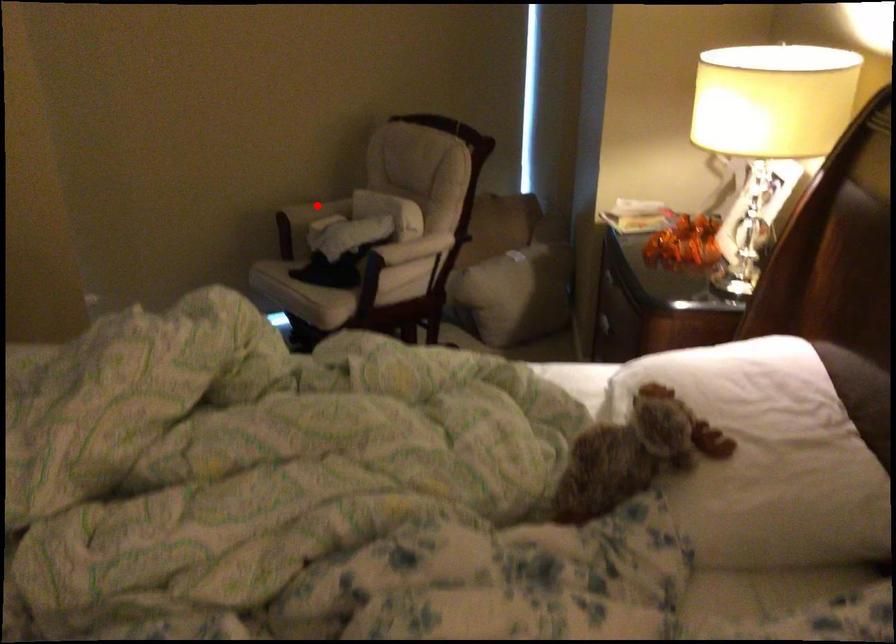
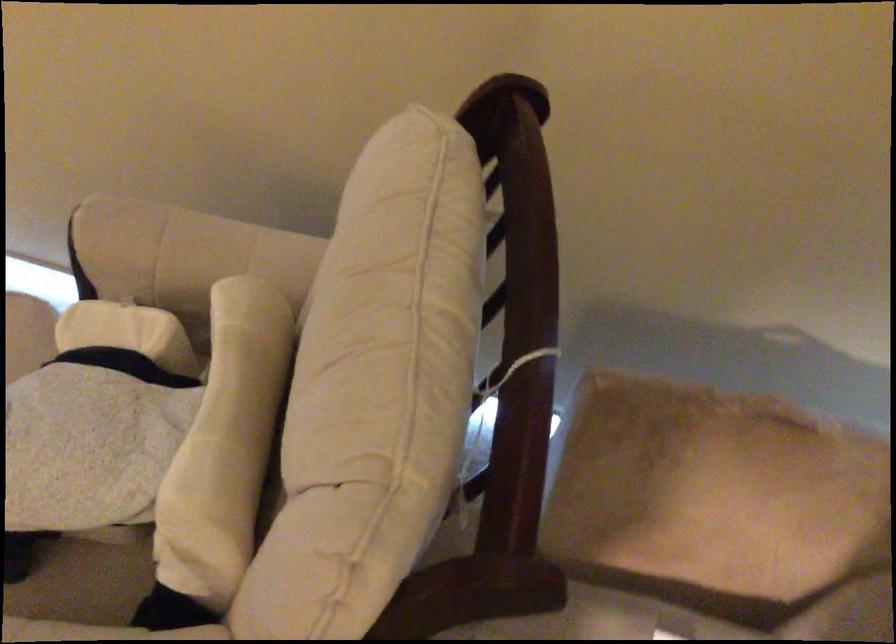
Question: I am providing you with two images of the same scene from different viewpoints. A red point is marked on the first image. At the location where the point appears in image 1, is it still visible in image 2?

Choices:
 (A) Yes
 (B) No

Answer: (A)